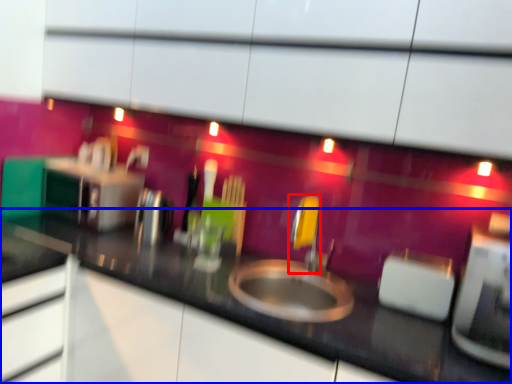
Question: Among these objects, which one is nearest to the camera, faucet (highlighted by a red box) or countertop (highlighted by a blue box)?

Choices:
 (A) faucet
 (B) countertop

Answer: (B)